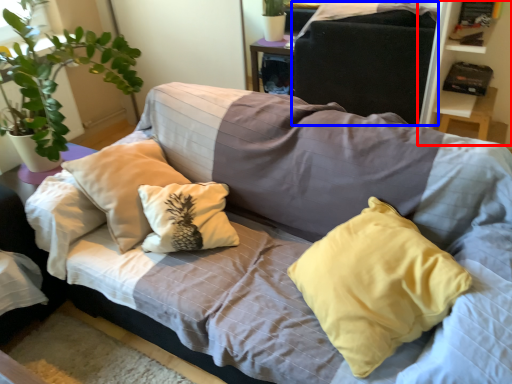
Question: Which object appears farthest to the camera in this image, bookshelf (highlighted by a red box) or gray (highlighted by a blue box)?

Choices:
 (A) bookshelf
 (B) gray

Answer: (B)